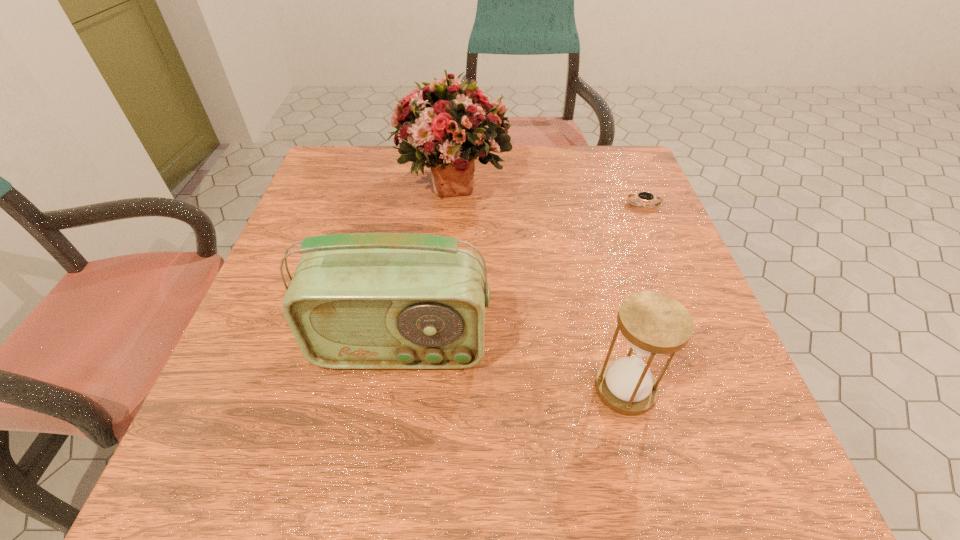
Find the location of a particular element. free point that satisfies the following two spatial constraints: 1. on the front panel of the radio receiver; 2. on the right side of the third object from left to right is located at coordinates (395, 388).

Where is `vacant space that satisfies the following two spatial constraints: 1. on the front panel of the hourglass; 2. on the right side of the radio receiver`? The width and height of the screenshot is (960, 540). vacant space that satisfies the following two spatial constraints: 1. on the front panel of the hourglass; 2. on the right side of the radio receiver is located at coordinates (395, 388).

At what (x,y) coordinates should I click in order to perform the action: click on blank area in the image that satisfies the following two spatial constraints: 1. on the front panel of the radio receiver; 2. on the left side of the second shortest object. Please return your answer as a coordinate pair (x, y). The width and height of the screenshot is (960, 540). Looking at the image, I should click on (395, 388).

Identify the location of free space that satisfies the following two spatial constraints: 1. on the front panel of the third tallest object; 2. on the right side of the radio receiver. Image resolution: width=960 pixels, height=540 pixels. (395, 388).